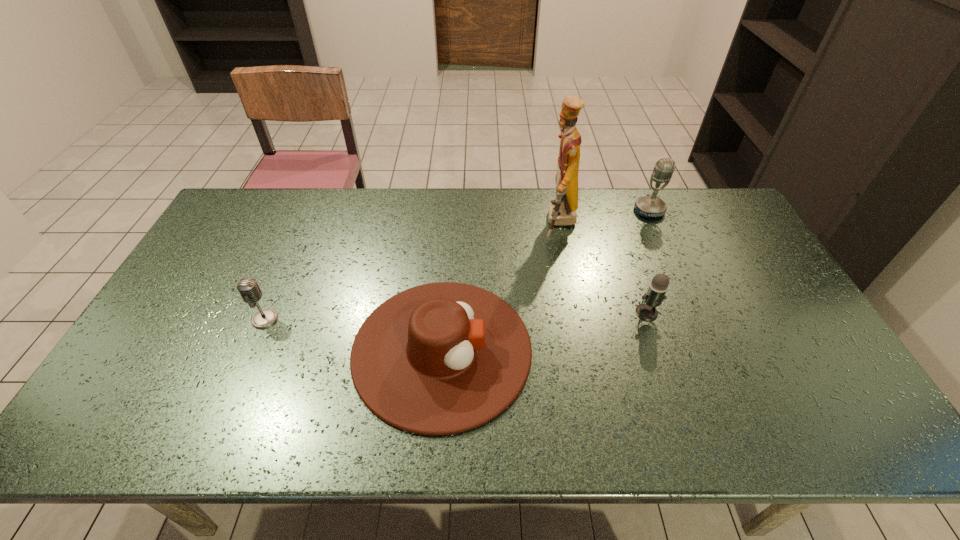
The height and width of the screenshot is (540, 960). Identify the location of vacant point at the left edge. (260, 236).

In the image, there is a desktop. What are the coordinates of `vacant region at the right edge` in the screenshot? It's located at (736, 266).

Where is `vacant point located between the tallest microphone and the second microphone from right to left`? This screenshot has width=960, height=540. vacant point located between the tallest microphone and the second microphone from right to left is located at coordinates (648, 261).

This screenshot has height=540, width=960. What are the coordinates of `free space between the cowboy hat and the rightmost object` in the screenshot? It's located at (545, 280).

I want to click on vacant area between the cowboy hat and the second object from right to left, so click(x=544, y=331).

This screenshot has height=540, width=960. Find the location of `unoccupied area between the fourth object from left to right and the nutcracker`. unoccupied area between the fourth object from left to right and the nutcracker is located at coordinates (603, 268).

At what (x,y) coordinates should I click in order to perform the action: click on free space that is in between the leftmost object and the shortest object. Please return your answer as a coordinate pair (x, y). The image size is (960, 540). Looking at the image, I should click on (353, 334).

Where is `unoccupied position between the leftmost microphone and the tallest microphone`? unoccupied position between the leftmost microphone and the tallest microphone is located at coordinates (457, 265).

You are a GUI agent. You are given a task and a screenshot of the screen. Output one action in this format:
    pyautogui.click(x=<x>, y=<y>)
    Task: Click on the free space between the rightmost object and the cowboy hat
    This screenshot has height=540, width=960.
    Given the screenshot: What is the action you would take?
    pyautogui.click(x=545, y=280)

Where is `free spot between the rightmost object and the nutcracker`? The height and width of the screenshot is (540, 960). free spot between the rightmost object and the nutcracker is located at coordinates (605, 217).